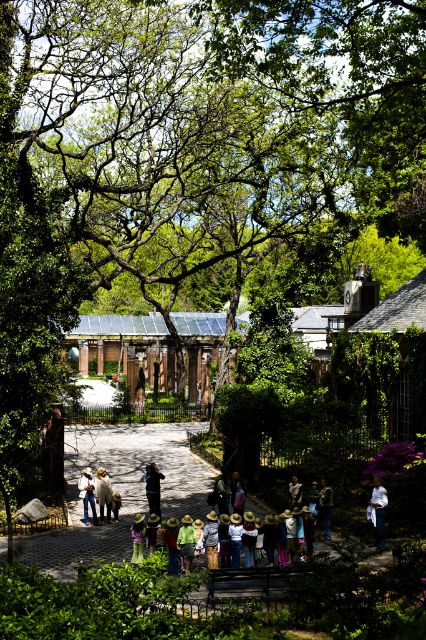
Question: Is denim jacket at center in front of khaki cotton shirt at lower right?

Choices:
 (A) yes
 (B) no

Answer: (B)

Question: Among these points, which one is nearest to the camera?

Choices:
 (A) (80, 490)
 (B) (290, 508)
 (C) (322, 483)

Answer: (C)

Question: Which of these objects is positioned farthest from the khaki cotton shirt at lower right?

Choices:
 (A) denim jacket at center
 (B) green straw hat at center

Answer: (A)

Question: Among these points, which one is nearest to the camera?

Choices:
 (A) (85, 477)
 (B) (374, 518)
 (C) (324, 529)

Answer: (B)

Question: From the image, what is the correct spatial relationship of light brown leather jacket at center in relation to light brown straw hat at center?

Choices:
 (A) above
 (B) below

Answer: (A)

Question: Does white cotton shirt at center have a greater width compared to denim jacket at center?

Choices:
 (A) no
 (B) yes

Answer: (A)